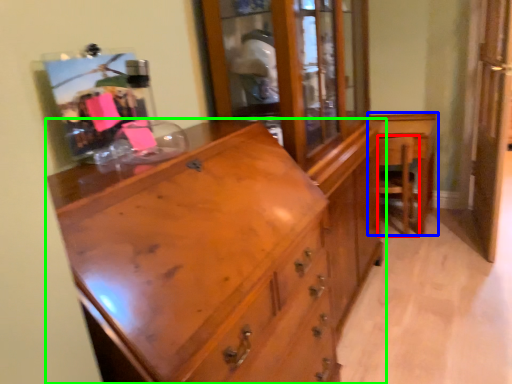
Question: Which object is positioned farthest from armchair (highlighted by a red box)? Select from table (highlighted by a blue box) and chest of drawers (highlighted by a green box).

Choices:
 (A) table
 (B) chest of drawers

Answer: (B)